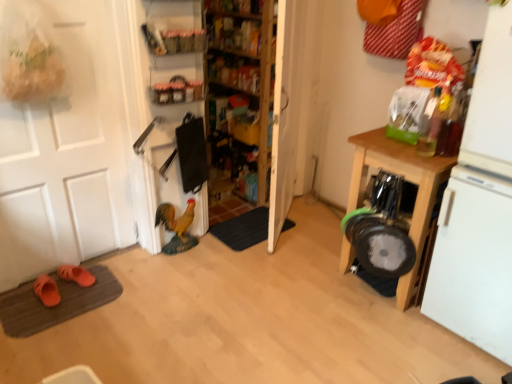
The image size is (512, 384). In order to click on vacant space to the right of orange suede slippers at lower left, the 1th footwear viewed from the back in this screenshot , I will do `click(103, 287)`.